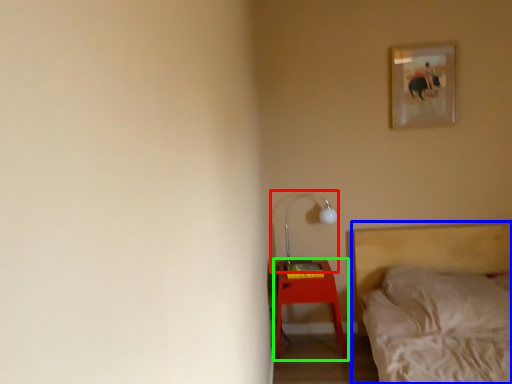
Question: Which object is the farthest from table lamp (highlighted by a red box)? Choose among these: bed (highlighted by a blue box) or nightstand (highlighted by a green box).

Choices:
 (A) bed
 (B) nightstand

Answer: (A)